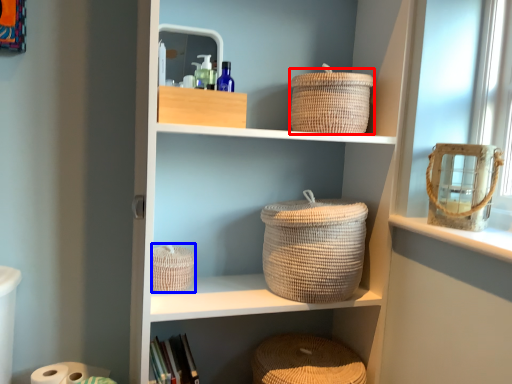
Question: Which object is further to the camera taking this photo, basket (highlighted by a red box) or basket (highlighted by a blue box)?

Choices:
 (A) basket
 (B) basket

Answer: (B)